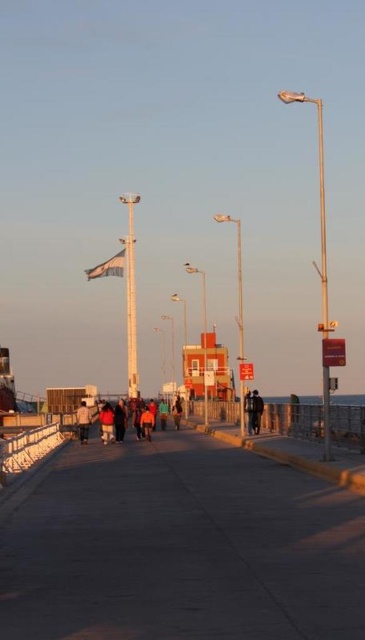
Question: Which point is farther to the camera?

Choices:
 (A) denim jacket at center
 (B) concrete sidewalk at center
 (C) dark blue jeans at center

Answer: (C)

Question: Which point is closer to the camera?

Choices:
 (A) (244, 401)
 (B) (182, 408)
 (C) (86, 426)

Answer: (A)

Question: Does concrete sidewalk at center have a smaller size compared to denim jacket at center?

Choices:
 (A) no
 (B) yes

Answer: (B)

Question: Which is nearer to the concrete sidewalk at center?

Choices:
 (A) dark brown leather jacket at center
 (B) dark blue fabric jacket at center
 (C) denim jacket at center
 (D) dark blue jeans at center

Answer: (B)

Question: Does concrete sidewalk at center appear under dark blue fabric jacket at center?

Choices:
 (A) no
 (B) yes

Answer: (A)

Question: Is denim jacket at center closer to the viewer compared to dark blue jeans at center?

Choices:
 (A) no
 (B) yes

Answer: (B)